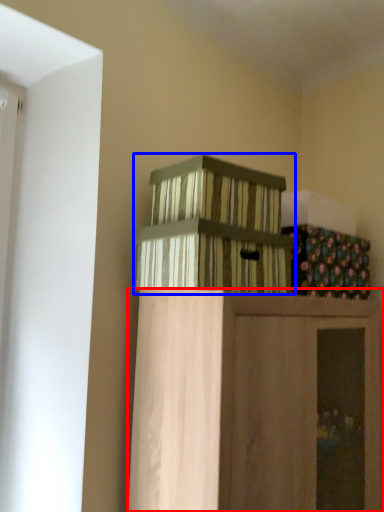
Question: Which of the following is the farthest to the observer, furniture (highlighted by a red box) or crate (highlighted by a blue box)?

Choices:
 (A) furniture
 (B) crate

Answer: (B)